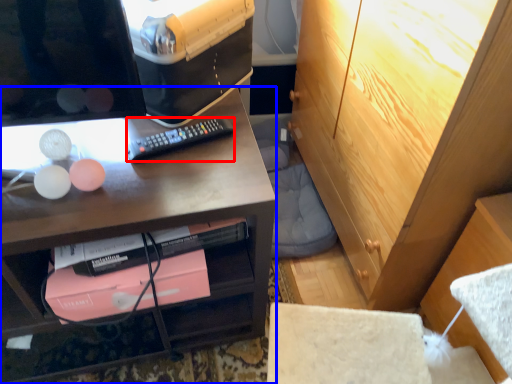
Question: Which object appears farthest to the camera in this image, remote control (highlighted by a red box) or desk (highlighted by a blue box)?

Choices:
 (A) remote control
 (B) desk

Answer: (A)